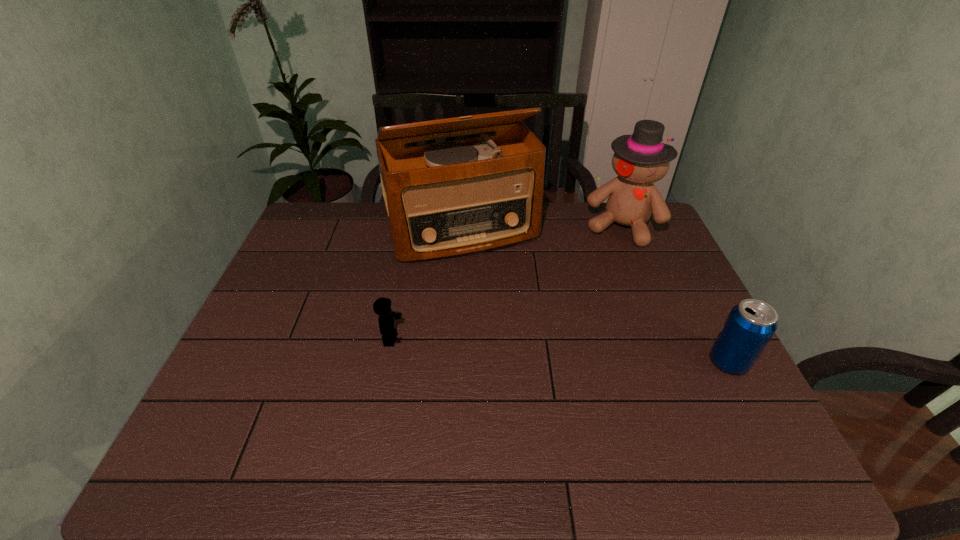
Locate an element on the screen. This screenshot has width=960, height=540. Lego is located at coordinates point(382,306).

In order to click on pop soda in this screenshot , I will do coord(750,325).

Where is `rag_doll`? This screenshot has width=960, height=540. rag_doll is located at coordinates (640, 159).

I want to click on radio receiver, so click(448, 199).

Where is `vacant space located 0.290m on the front-facing side of the Lego`? vacant space located 0.290m on the front-facing side of the Lego is located at coordinates (515, 339).

Find the location of a particular element. This screenshot has width=960, height=540. vacant space located on the front of the pop soda is located at coordinates 749,400.

Locate an element on the screen. The image size is (960, 540). free region located 0.190m on the front-facing side of the third shortest object is located at coordinates (600, 284).

I want to click on vacant space located 0.390m on the front-facing side of the third shortest object, so click(582, 331).

The image size is (960, 540). What are the coordinates of `free space located 0.360m on the front-facing side of the third shortest object` in the screenshot? It's located at (585, 323).

The image size is (960, 540). Identify the location of free region located 0.050m on the front panel of the tallest object. [490, 274].